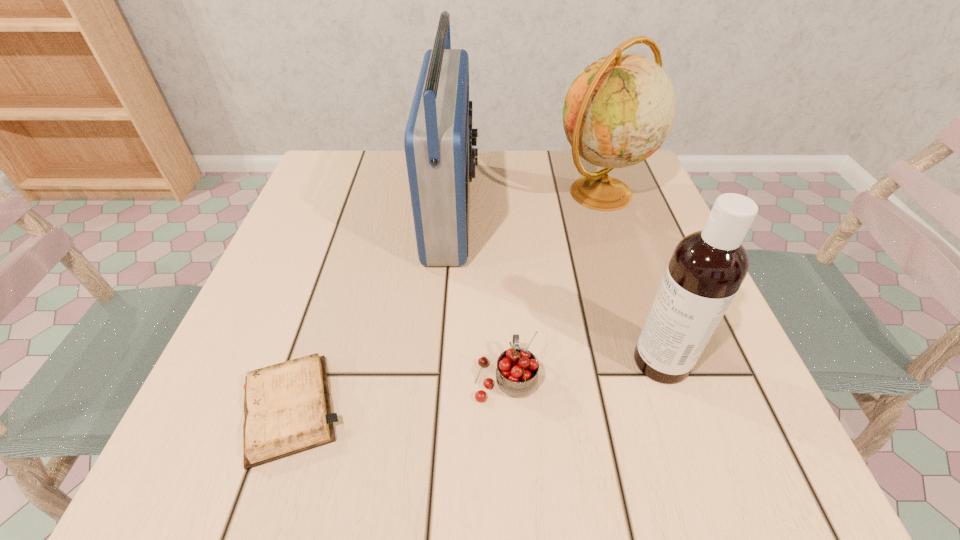
Identify which object is located as the fourth nearest to the cherry. Please provide its 2D coordinates. Your answer should be formatted as a tuple, i.e. [(x, y)], where the tuple contains the x and y coordinates of a point satisfying the conditions above.

[(620, 109)]

Identify the location of free spot that satisfies the following two spatial constraints: 1. on the front panel of the radio receiver; 2. on the handle side of the cherry. (441, 377).

Locate an element on the screen. This screenshot has width=960, height=540. free space that satisfies the following two spatial constraints: 1. on the front panel of the radio receiver; 2. on the handle side of the cherry is located at coordinates (441, 377).

Locate an element on the screen. free location that satisfies the following two spatial constraints: 1. on the front side of the globe; 2. on the front panel of the radio receiver is located at coordinates (605, 209).

Find the location of a particular element. The image size is (960, 540). vacant area in the image that satisfies the following two spatial constraints: 1. on the front panel of the radio receiver; 2. on the handle side of the fourth tallest object is located at coordinates (441, 377).

Identify the location of free space in the image that satisfies the following two spatial constraints: 1. on the front panel of the radio receiver; 2. on the handle side of the second shortest object. The width and height of the screenshot is (960, 540). (441, 377).

Locate an element on the screen. free point that satisfies the following two spatial constraints: 1. on the front panel of the radio receiver; 2. on the handle side of the fourth tallest object is located at coordinates (441, 377).